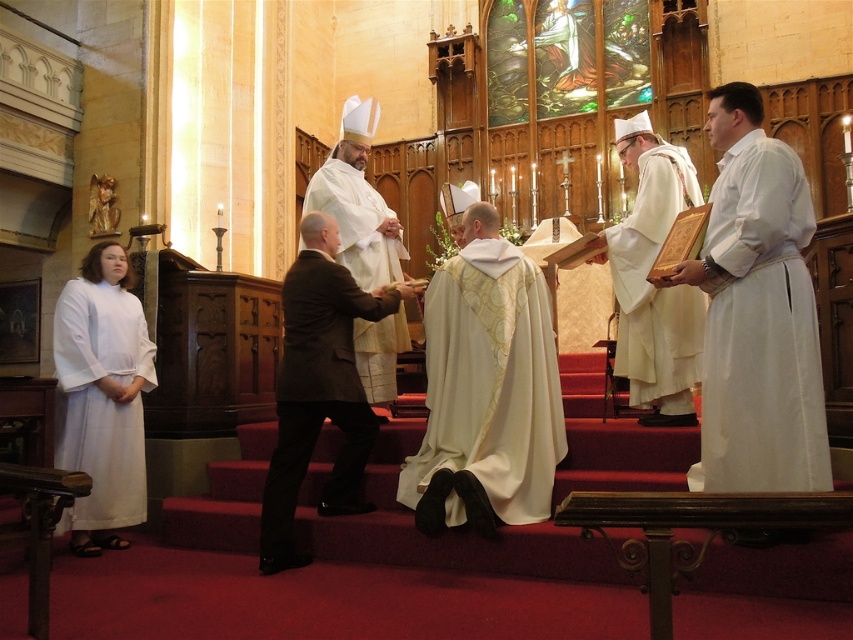
Is point (83, 394) farther from viewer compared to point (302, 204)?

That is False.

Image resolution: width=853 pixels, height=640 pixels. I want to click on white matte/soft robe at left, so click(100, 401).

The width and height of the screenshot is (853, 640). What do you see at coordinates (100, 401) in the screenshot? I see `white matte/soft robe at left` at bounding box center [100, 401].

The width and height of the screenshot is (853, 640). What are the coordinates of `white matte/soft robe at left` in the screenshot? It's located at (100, 401).

Which is below, dark gray wool suit at center or white silk robe at center?

dark gray wool suit at center is below.

Is dark gray wool suit at center thinner than white silk robe at center?

In fact, dark gray wool suit at center might be wider than white silk robe at center.

At what (x,y) coordinates should I click in order to perform the action: click on dark gray wool suit at center. Please return your answer as a coordinate pair (x, y). This screenshot has height=640, width=853. Looking at the image, I should click on (x=318, y=396).

Does point (726, 228) come farther from viewer compared to point (368, 364)?

No, it is not.

Locate an element on the screen. The image size is (853, 640). white cloth robe at right is located at coordinates (759, 330).